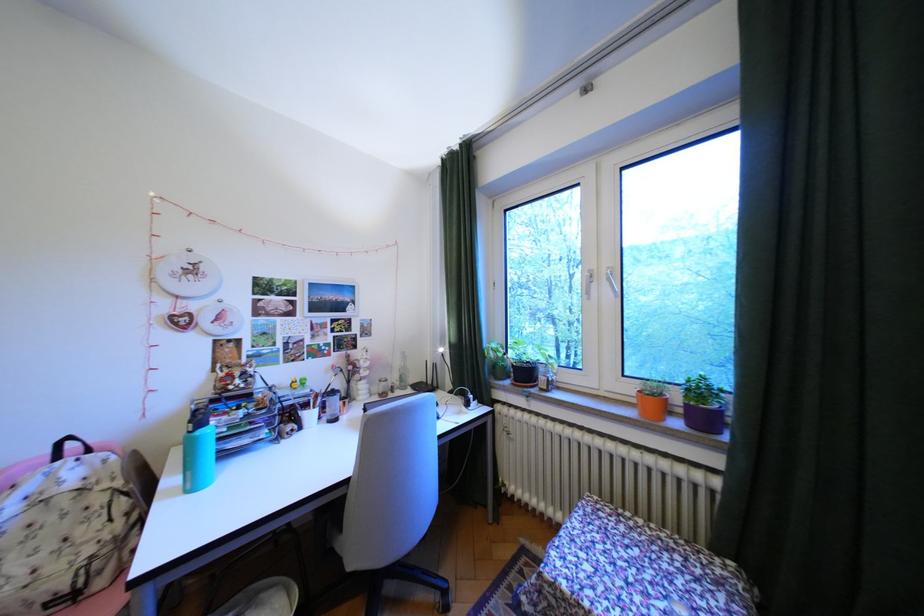
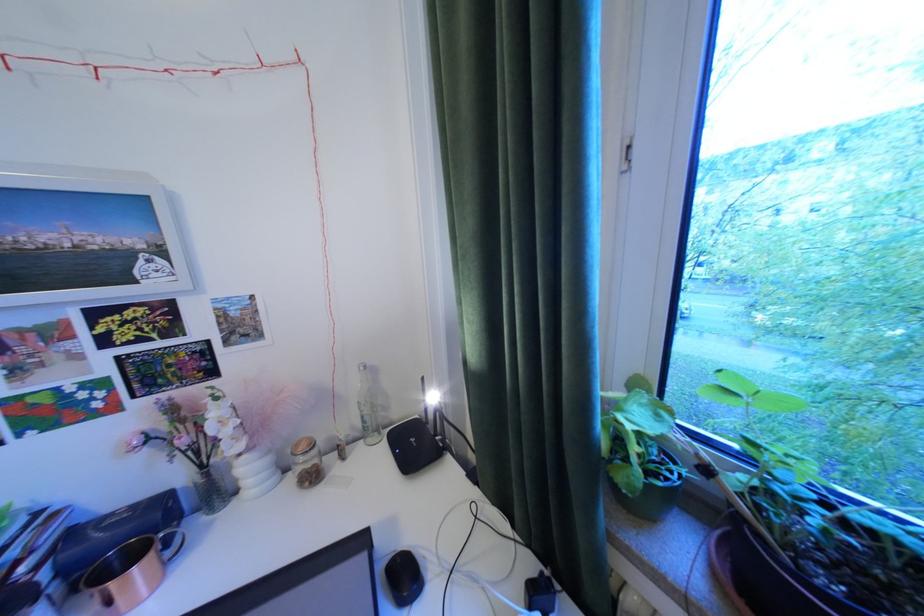
Question: In a continuous first-person perspective shot, in which direction is the camera moving?

Choices:
 (A) Left
 (B) Right
 (C) Forward
 (D) Backward

Answer: (C)